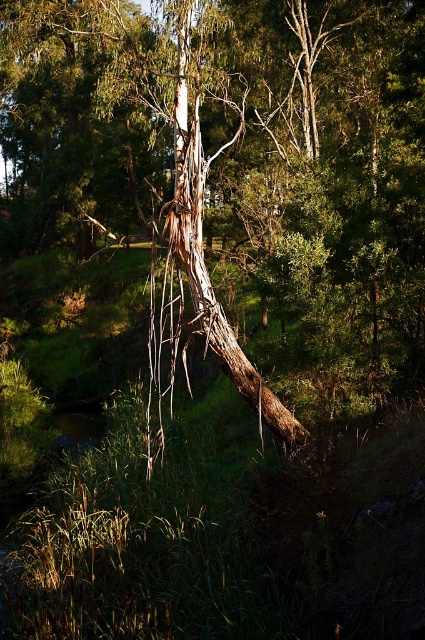
You are a hiker who wants to cross the fallen tree. You see the brown bark tree at center and the brown rough bark tree trunk at center. Which one should you step on first to cross?

You should step on the brown bark tree at center first because it is to the left of the brown rough bark tree trunk at center, so it comes first in the path.

You are a hiker who wants to take a photo of the brown bark tree at center. You have a camera with a zoom lens that can focus up to 10 meters. Can you capture the tree without moving closer?

The brown bark tree at center is 9.34 meters from viewer. Since the camera can focus up to 10 meters, you can capture the tree without moving closer.